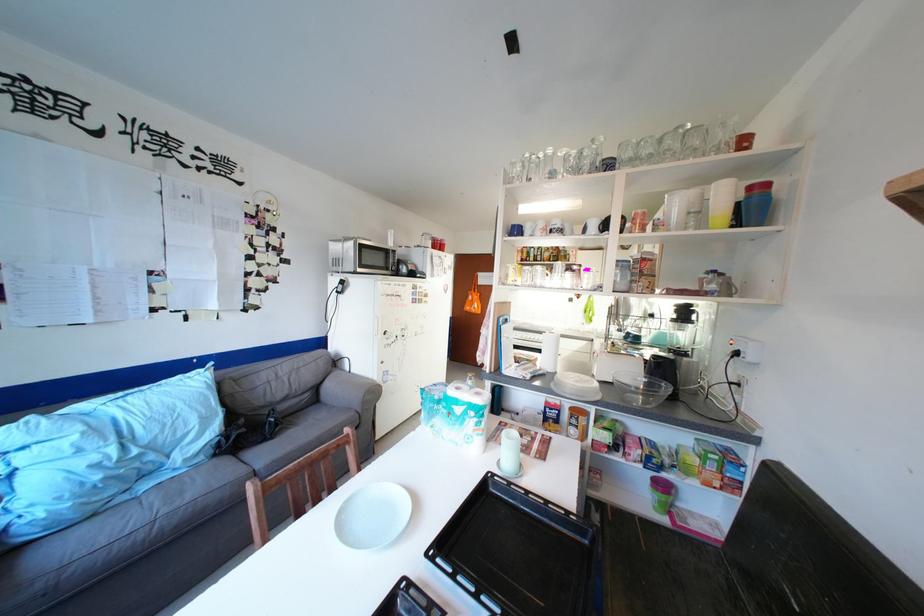
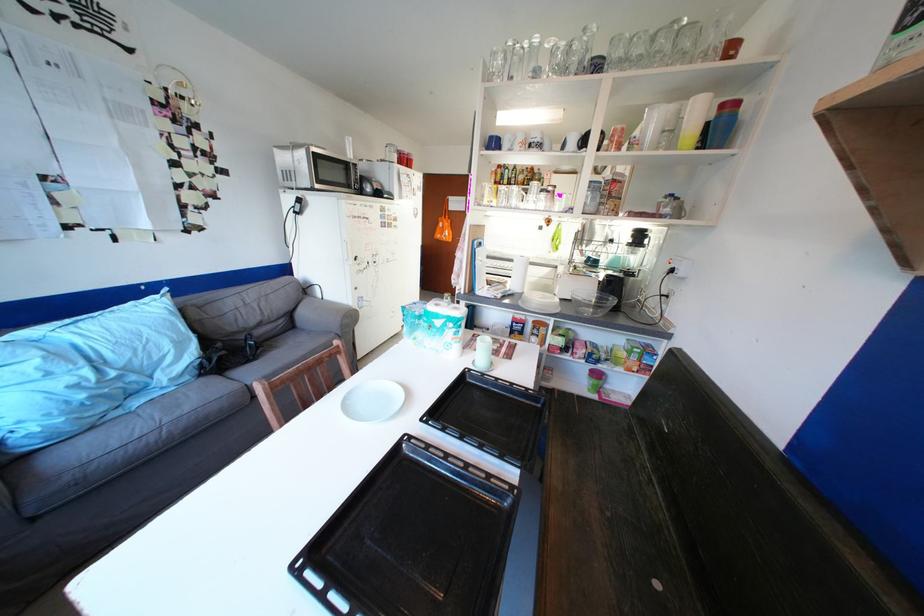
The point at (691,315) is marked in the first image. Where is the corresponding point in the second image?

(647, 241)